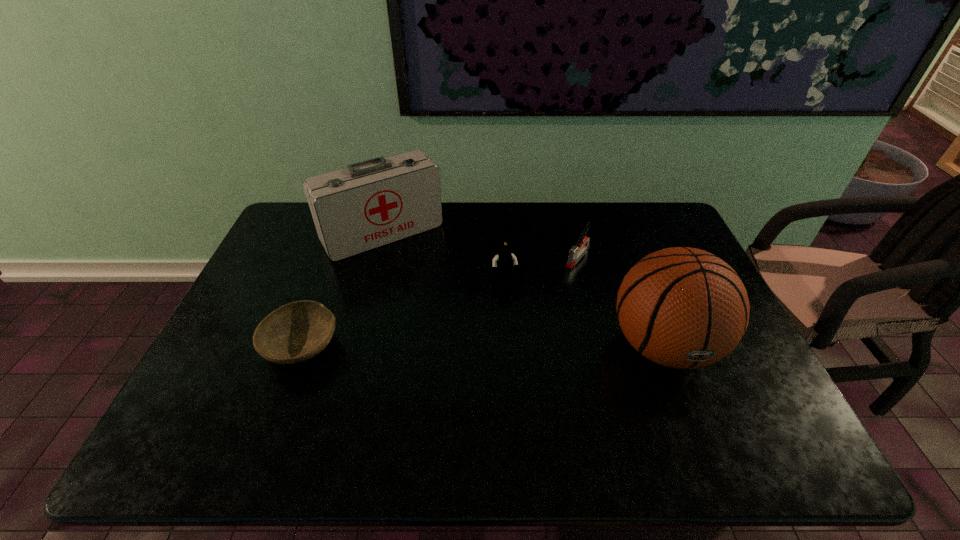
Where is `vacant spot on the desktop that is between the shortest object and the basketball and is positioned on the handle side of the stapler`? Image resolution: width=960 pixels, height=540 pixels. vacant spot on the desktop that is between the shortest object and the basketball and is positioned on the handle side of the stapler is located at coordinates (501, 346).

In order to click on vacant spot on the desktop that is between the bowl and the basketball and is positioned on the front-facing side of the first-aid kit in this screenshot , I will do `click(462, 346)`.

Where is `free spot on the desktop that is between the bowl and the basketball and is positioned on the front-facing side of the third object from right to left`? free spot on the desktop that is between the bowl and the basketball and is positioned on the front-facing side of the third object from right to left is located at coordinates (523, 346).